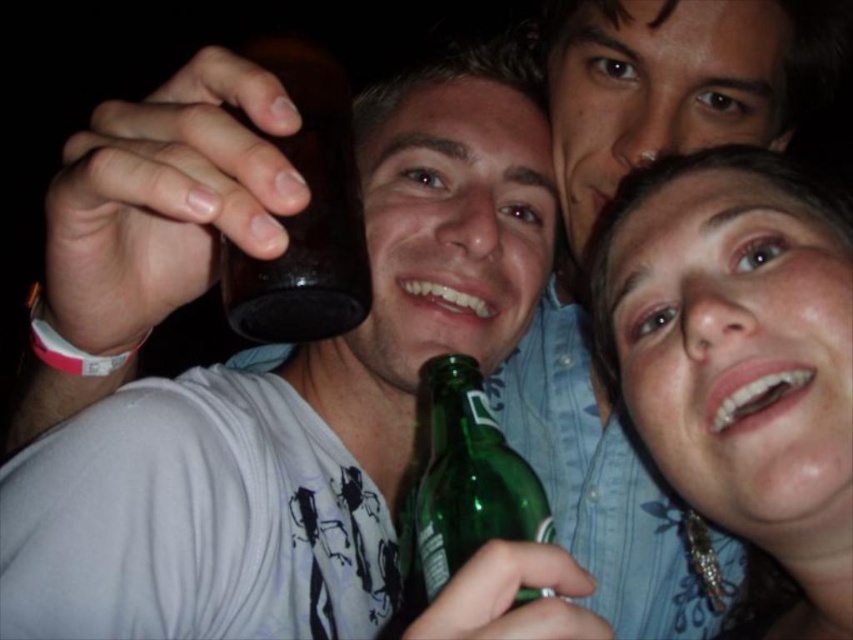
Does point (682, 392) come closer to viewer compared to point (228, 106)?

No.

Identify the location of matte green bottle at lower right. (740, 364).

Is brown glass bottle at upper left bigger than green glass bottle at lower center?

Incorrect, brown glass bottle at upper left is not larger than green glass bottle at lower center.

Can you confirm if brown glass bottle at upper left is positioned to the right of green glass bottle at lower center?

No, brown glass bottle at upper left is not to the right of green glass bottle at lower center.

Identify the location of brown glass bottle at upper left. pyautogui.click(x=305, y=212).

Is matte green bottle at lower right to the left of green glass bottle at lower center from the viewer's perspective?

No, matte green bottle at lower right is not to the left of green glass bottle at lower center.

Who is more forward, [798,360] or [432,380]?

Point [798,360] is in front.

Where is `matte green bottle at lower right`? matte green bottle at lower right is located at coordinates (740, 364).